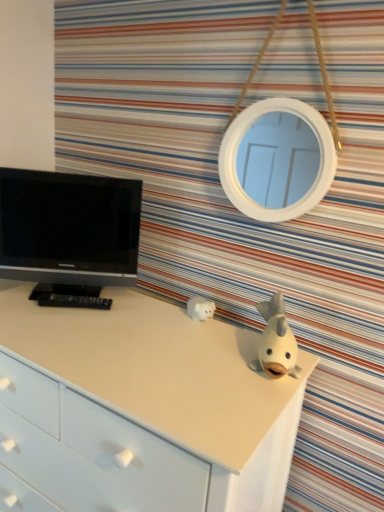
Locate an element on the screen. Image resolution: width=384 pixels, height=512 pixels. empty space that is to the right of black glossy tv at left is located at coordinates (155, 316).